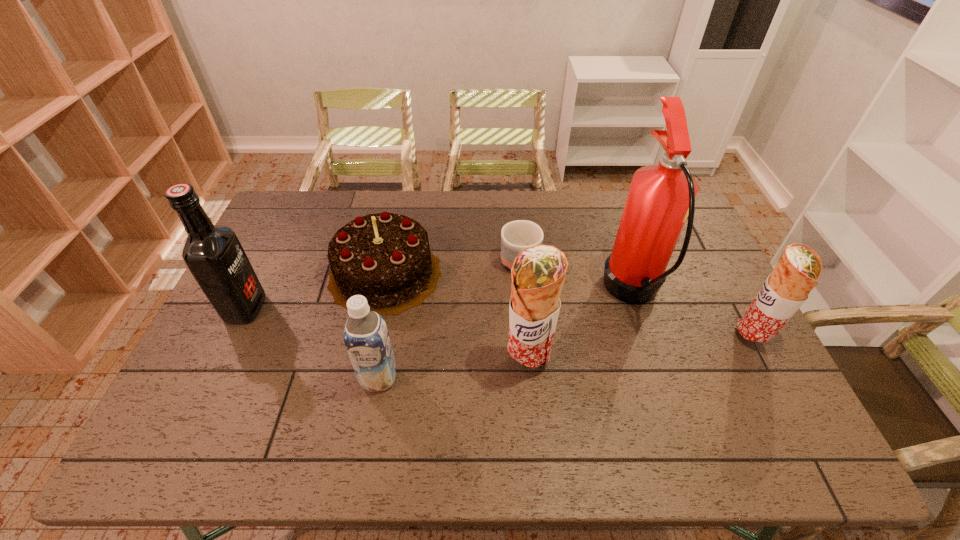
Identify the location of unoccupied area between the mug and the fire extinguisher. (577, 280).

Locate an element on the screen. The image size is (960, 540). vacant space that's between the soya milk and the shorter burrito is located at coordinates (565, 357).

You are a GUI agent. You are given a task and a screenshot of the screen. Output one action in this format:
    pyautogui.click(x=<x>, y=<y>)
    Task: Click on the free space between the leftmost object and the birthday cake
    The width and height of the screenshot is (960, 540).
    Given the screenshot: What is the action you would take?
    pyautogui.click(x=315, y=291)

Identify the location of blank region between the second shortest object and the right burrito. (568, 306).

Image resolution: width=960 pixels, height=540 pixels. Identify the location of object that is the fourth closest to the second object from right to left. (385, 257).

Choose which object is the fifth nearest neighbor to the left burrito. Please provide its 2D coordinates. Your answer should be formatted as a tuple, i.e. [(x, y)], where the tuple contains the x and y coordinates of a point satisfying the conditions above.

[(786, 289)]

Locate an element on the screen. This screenshot has width=960, height=540. vacant space that satisfies the following two spatial constraints: 1. on the back side of the right burrito; 2. at the spray nozzle of the tallest object is located at coordinates (729, 293).

At what (x,y) coordinates should I click in order to perform the action: click on free spot that satisfies the following two spatial constraints: 1. at the spray nozzle of the tallest object; 2. on the left side of the right burrito. Please return your answer as a coordinate pair (x, y). The width and height of the screenshot is (960, 540). Looking at the image, I should click on 647,337.

Locate an element on the screen. The height and width of the screenshot is (540, 960). free space that satisfies the following two spatial constraints: 1. at the spray nozzle of the second object from right to left; 2. on the back side of the shorter burrito is located at coordinates (647, 337).